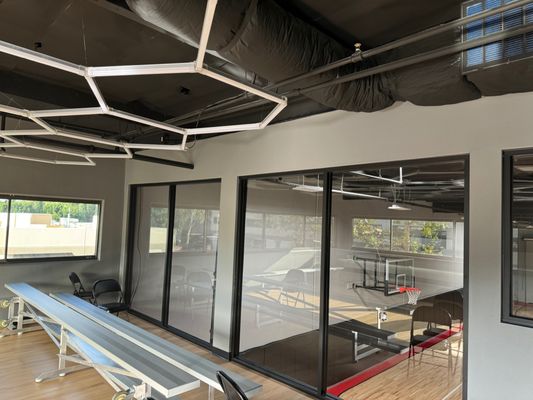
Locate an element on the screen. brown wooden floor is located at coordinates (38, 359).